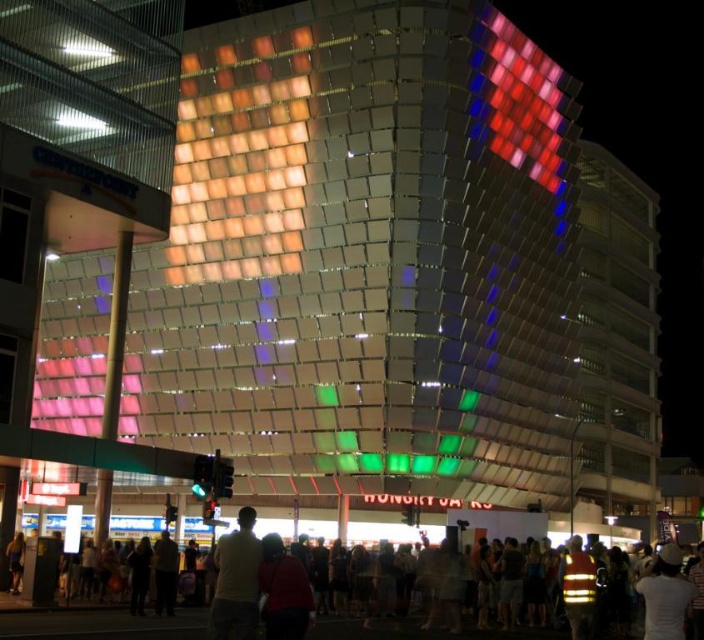
Question: Is dark gray shirt at center below dark blue jeans at lower left?

Choices:
 (A) yes
 (B) no

Answer: (A)

Question: Which point is farther from the camera taking this photo?

Choices:
 (A) pyautogui.click(x=1, y=609)
 (B) pyautogui.click(x=15, y=548)
 (C) pyautogui.click(x=210, y=618)

Answer: (B)

Question: Can you confirm if dark gray shirt at center is positioned to the left of white matte shirt at center?

Choices:
 (A) yes
 (B) no

Answer: (B)

Question: Which point appears closest to the camera in this image?

Choices:
 (A) (18, 556)
 (B) (234, 616)
 (C) (11, 612)

Answer: (B)

Question: Among these points, which one is nearest to the camera?

Choices:
 (A) (494, 637)
 (B) (256, 612)

Answer: (B)

Question: Can you confirm if dark gray shirt at center is positioned to the left of dark blue jeans at lower left?

Choices:
 (A) no
 (B) yes

Answer: (A)